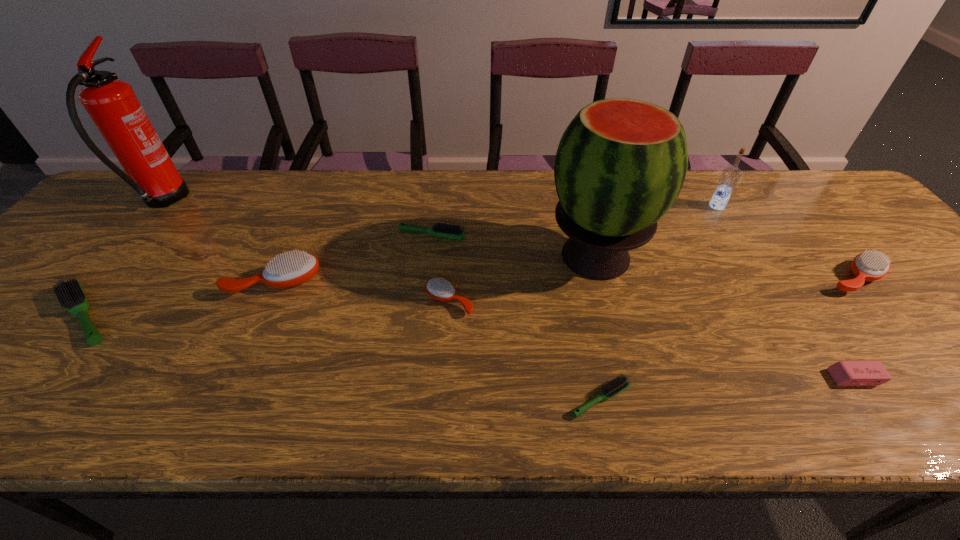
The image size is (960, 540). I want to click on fire extinguisher that is at the left edge, so click(112, 104).

The height and width of the screenshot is (540, 960). Find the location of `hairbrush that is at the left edge`. hairbrush that is at the left edge is located at coordinates (70, 294).

Where is `object at the right edge`? This screenshot has width=960, height=540. object at the right edge is located at coordinates (867, 266).

This screenshot has width=960, height=540. What are the coordinates of `object that is at the far left corner` in the screenshot? It's located at (112, 104).

This screenshot has width=960, height=540. Identify the location of vacant space at the far edge of the desktop. (746, 210).

Locate an element on the screen. vacant space at the near edge is located at coordinates [x=238, y=420].

Identify the location of vacant space at the left edge of the desktop. (110, 252).

Locate an element on the screen. vacant space at the right edge is located at coordinates (892, 243).

Where is `free spot between the third tallest object and the rightmost hairbrush`? The height and width of the screenshot is (540, 960). free spot between the third tallest object and the rightmost hairbrush is located at coordinates pyautogui.click(x=785, y=242).

What are the coordinates of `vacant area that lies between the second farthest light hairbrush and the watermelon` in the screenshot? It's located at (340, 286).